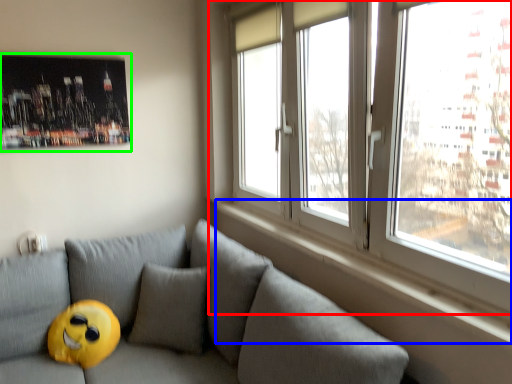
Question: Considering the real-world distances, which object is closest to window (highlighted by a red box)? window sill (highlighted by a blue box) or picture frame (highlighted by a green box).

Choices:
 (A) window sill
 (B) picture frame

Answer: (A)